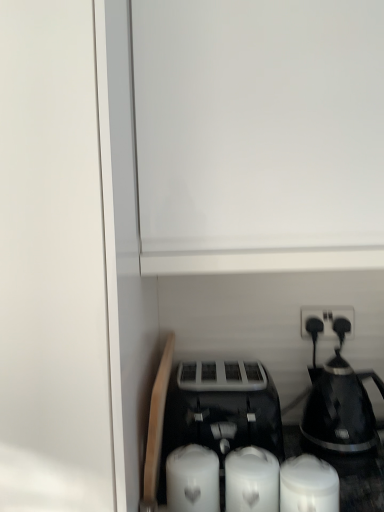
Question: Does black glossy coffee maker at right have a lesser width compared to black plastic toaster at center?

Choices:
 (A) yes
 (B) no

Answer: (A)

Question: Is black glossy coffee maker at right closer to camera compared to black plastic toaster at center?

Choices:
 (A) yes
 (B) no

Answer: (B)

Question: Does black glossy coffee maker at right have a larger size compared to black plastic toaster at center?

Choices:
 (A) no
 (B) yes

Answer: (A)

Question: Is black glossy coffee maker at right to the left of black plastic toaster at center from the viewer's perspective?

Choices:
 (A) yes
 (B) no

Answer: (B)

Question: From a real-world perspective, is black glossy coffee maker at right over black plastic toaster at center?

Choices:
 (A) no
 (B) yes

Answer: (B)

Question: Is black glossy coffee maker at right facing towards black plastic toaster at center?

Choices:
 (A) yes
 (B) no

Answer: (B)

Question: Is white matte candle at lower center, placed as the third candle when sorted from right to left, facing towards black plastic toaster at center?

Choices:
 (A) no
 (B) yes

Answer: (A)

Question: Does white matte candle at lower center, placed as the third candle when sorted from right to left, have a larger size compared to black plastic toaster at center?

Choices:
 (A) no
 (B) yes

Answer: (A)

Question: From a real-world perspective, is white matte candle at lower center, placed as the third candle when sorted from right to left, located beneath black plastic toaster at center?

Choices:
 (A) yes
 (B) no

Answer: (A)

Question: Considering the relative sizes of white matte candle at lower center, placed as the third candle when sorted from right to left, and black plastic toaster at center in the image provided, is white matte candle at lower center, placed as the third candle when sorted from right to left, thinner than black plastic toaster at center?

Choices:
 (A) no
 (B) yes

Answer: (B)

Question: Is black plastic toaster at center at the back of white matte candle at lower center, placed as the third candle when sorted from right to left?

Choices:
 (A) no
 (B) yes

Answer: (B)

Question: Does white matte candle at lower center, which is the 1th candle from left to right, have a lesser height compared to black plastic toaster at center?

Choices:
 (A) no
 (B) yes

Answer: (B)

Question: Is white matte candle at lower center, placed as the third candle when sorted from right to left, facing towards black plastic electric outlet at upper right?

Choices:
 (A) yes
 (B) no

Answer: (B)